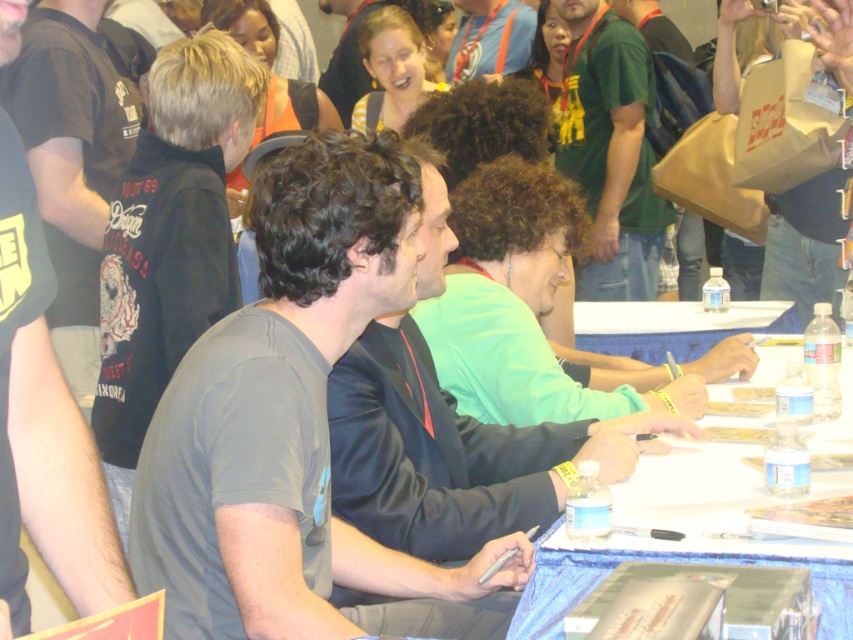
At what (x,y) coordinates should I click in order to perform the action: click on green fabric shirt at upper center. Please return your answer as a coordinate pair (x, y). The height and width of the screenshot is (640, 853). Looking at the image, I should click on (610, 150).

How much distance is there between green fabric shirt at upper center and matte black shirt at upper center?

A distance of 1.03 meters exists between green fabric shirt at upper center and matte black shirt at upper center.

Locate an element on the screen. This screenshot has height=640, width=853. green fabric shirt at upper center is located at coordinates (610, 150).

The width and height of the screenshot is (853, 640). In order to click on green fabric shirt at upper center in this screenshot , I will do `click(610, 150)`.

Measure the distance between black t-shirt at left and green fabric shirt at upper center.

12.49 feet

Who is more distant from viewer, (35, 236) or (608, 60)?

The point (608, 60) is more distant.

Who is more forward, [49,353] or [641,38]?

Point [49,353] is more forward.

The width and height of the screenshot is (853, 640). Identify the location of black t-shirt at left. (51, 424).

Can you confirm if gray matte t-shirt at center is shorter than black t-shirt at left?

No.

Describe the element at coordinates (293, 428) in the screenshot. The height and width of the screenshot is (640, 853). I see `gray matte t-shirt at center` at that location.

Between point (242, 426) and point (102, 540), which one is positioned behind?

The point (242, 426) is more distant.

The image size is (853, 640). In order to click on gray matte t-shirt at center in this screenshot , I will do `click(293, 428)`.